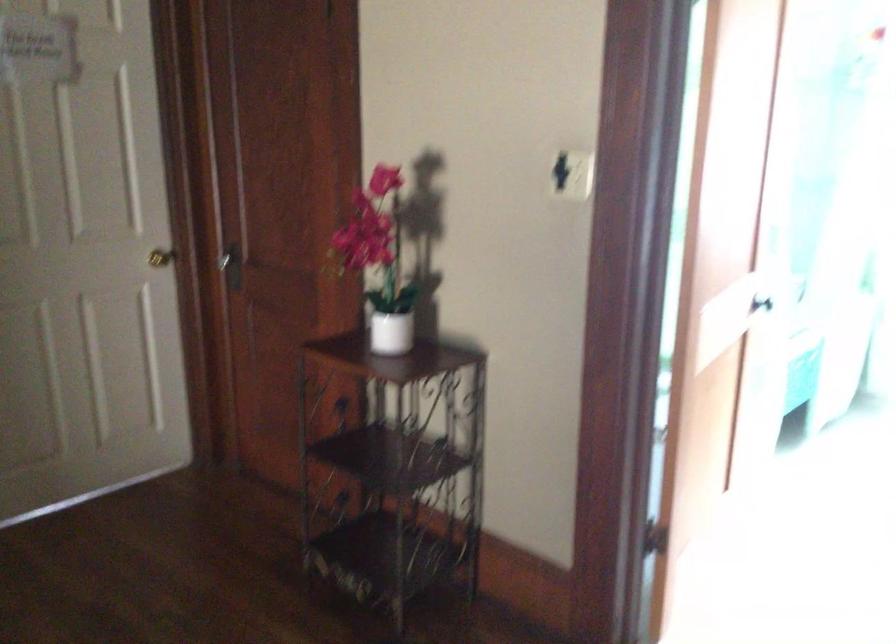
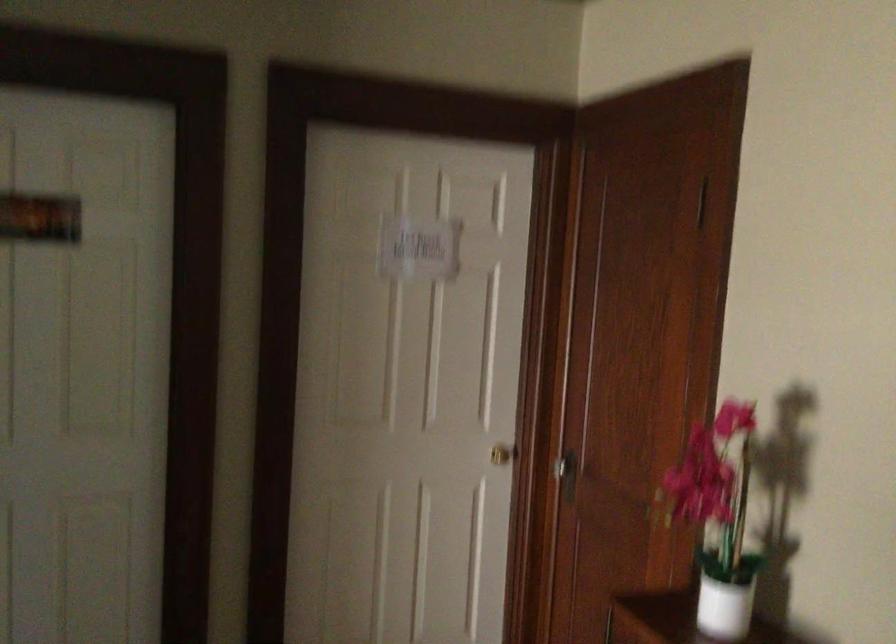
The point at (229, 259) is marked in the first image. Where is the corresponding point in the second image?

(565, 471)